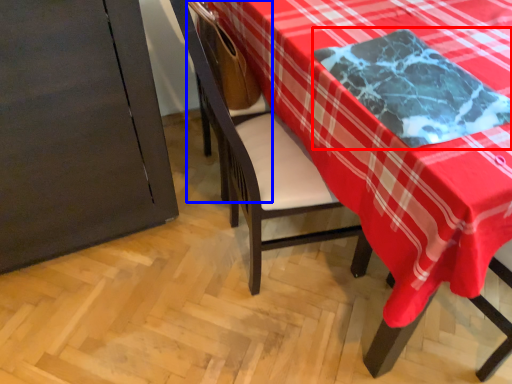
Question: Which of the following is the farthest to the observer, cloth (highlighted by a red box) or armchair (highlighted by a blue box)?

Choices:
 (A) cloth
 (B) armchair

Answer: (B)